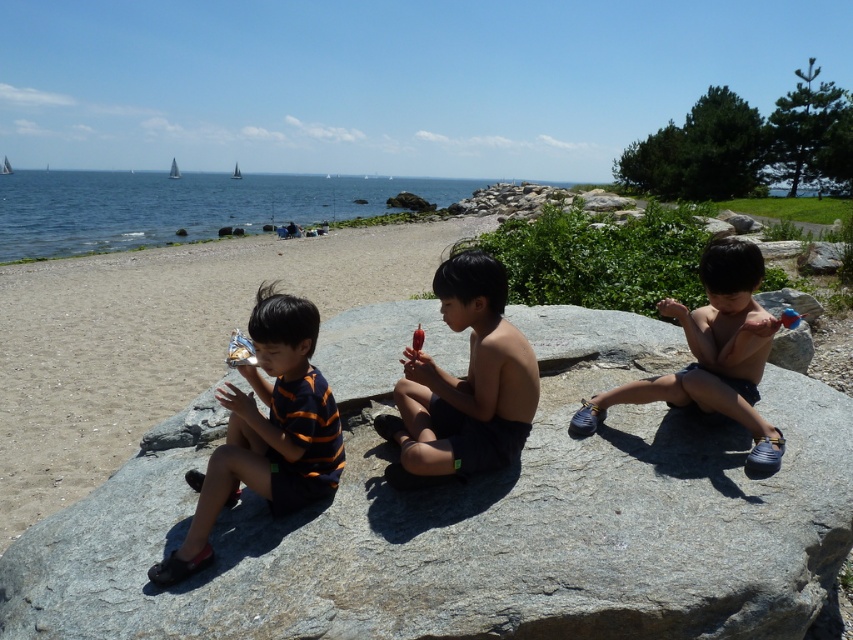
You are a photographer trying to capture a wide shot of the beach scene. Since you want to include both the blue water at upper left and the smooth skin boy at center, which one should you prioritize framing to ensure it takes up more space in the photo?

The blue water at upper left is larger in size than the smooth skin boy at center, so you should prioritize framing the blue water at upper left to ensure it takes up more space in the photo.

You are a photographer trying to capture the nude skin child at center and the blue water at upper left in the same frame. Which object is closer to your camera lens?

The blue water at upper left is closer to the camera lens because it is further to the viewer than the nude skin child at center, meaning it appears nearer in the scene.